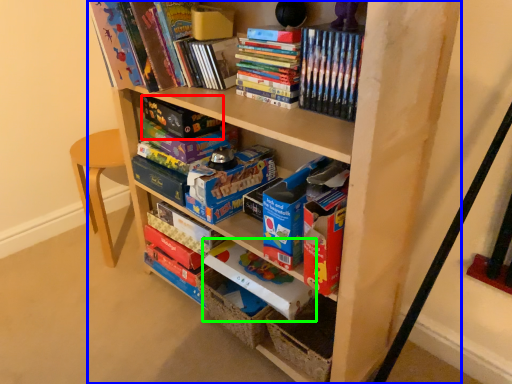
Question: Based on their relative distances, which object is farther from paperback book (highlighted by a red box)? Choose from shelf (highlighted by a blue box) and paperback book (highlighted by a green box).

Choices:
 (A) shelf
 (B) paperback book

Answer: (A)